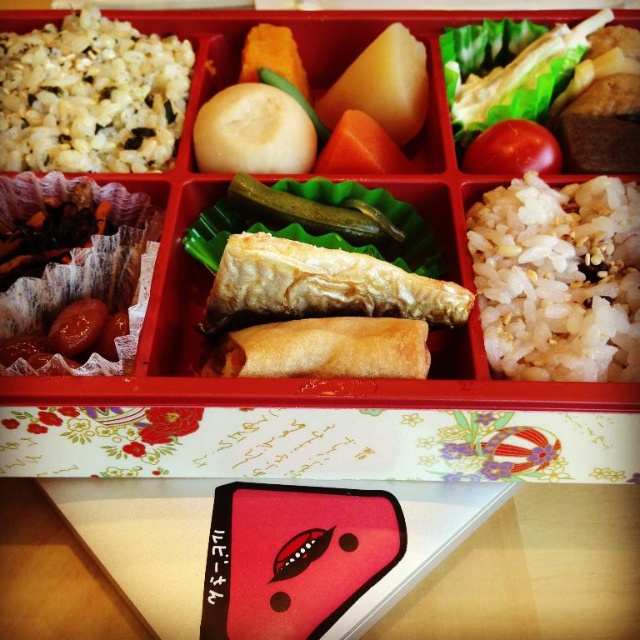
You are a chef trying to place two decorative picks in a bento box. You have two points marked as reference points in the bento box. The first point is at coordinates point (166,291) and the second point is at coordinates point (637,348). Which of these two points is closer to you when looking at the bento box?

Point (166,291) is closer to you than point (637,348) because it is further to the viewer according to the description.

You are a food delivery robot standing 1.5 meters away from the bento box. You need to pick up the point at coordinates point (196, 266). Can you reach it without moving closer?

The distance of point (196, 266) from viewer is 1.19 meters, so the robot can reach it without moving closer since it is within the 1.5 meters distance.